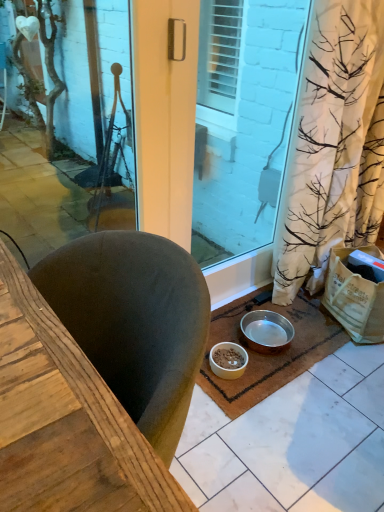
You are a GUI agent. You are given a task and a screenshot of the screen. Output one action in this format:
    pyautogui.click(x=<x>, y=<y>)
    Task: Click on the free space in front of transparent glass screen door at center
    This screenshot has height=512, width=384.
    Given the screenshot: What is the action you would take?
    pyautogui.click(x=254, y=360)